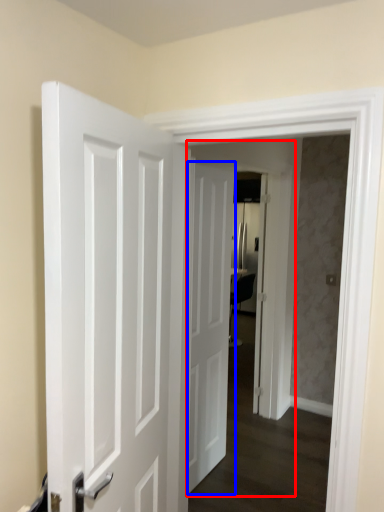
Question: Which object appears farthest to the camera in this image, screen door (highlighted by a red box) or door (highlighted by a blue box)?

Choices:
 (A) screen door
 (B) door

Answer: (B)